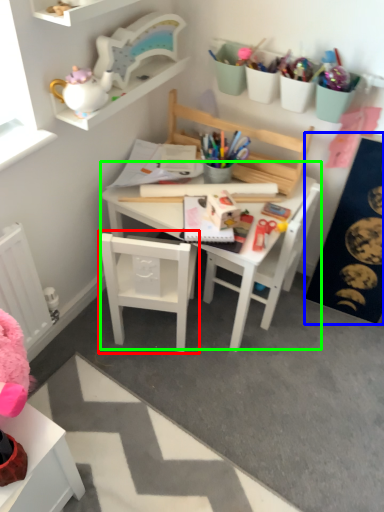
Question: Which object is the farthest from chair (highlighted by a red box)? Choose among these: bulletin board (highlighted by a blue box) or table (highlighted by a green box).

Choices:
 (A) bulletin board
 (B) table

Answer: (A)